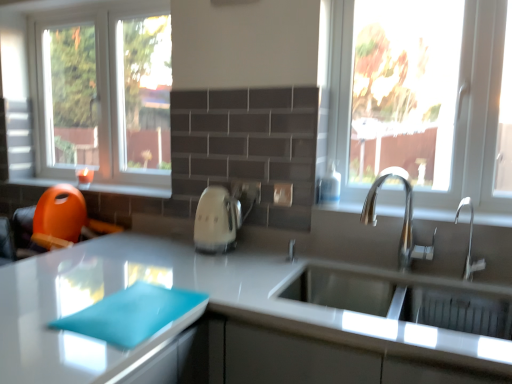
The width and height of the screenshot is (512, 384). Identify the location of blank space to the left of satin nickel faucet at sink right, positioned as the second tap in left-to-right order. (429, 274).